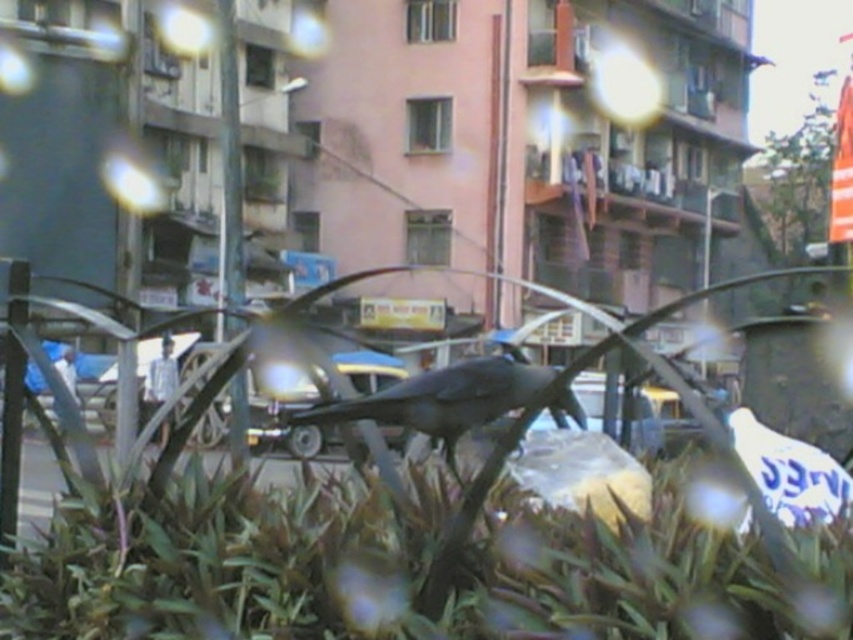
In the scene shown: Does green leafy plant at center appear over shiny black bird at center?

Actually, green leafy plant at center is below shiny black bird at center.

Does point (640, 532) lie in front of point (469, 413)?

Yes, point (640, 532) is closer to viewer.

Identify the location of green leafy plant at center. (370, 568).